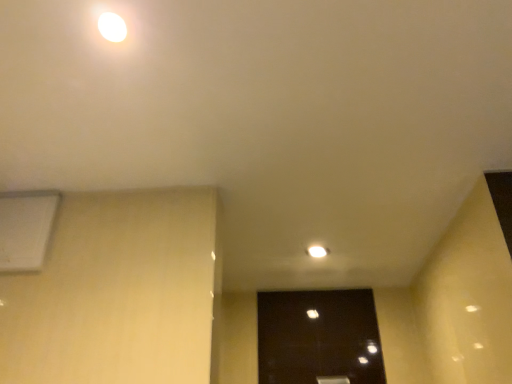
Question: Would you say white matte air conditioning at upper left is a long distance from white glossy light at upper center?

Choices:
 (A) no
 (B) yes

Answer: (A)

Question: From the image's perspective, is white matte air conditioning at upper left on white glossy light at upper center?

Choices:
 (A) yes
 (B) no

Answer: (B)

Question: Does white matte air conditioning at upper left have a greater height compared to white glossy light at upper center?

Choices:
 (A) yes
 (B) no

Answer: (A)

Question: Is white matte air conditioning at upper left next to white glossy light at upper center and touching it?

Choices:
 (A) yes
 (B) no

Answer: (B)

Question: From a real-world perspective, is white matte air conditioning at upper left located beneath white glossy light at upper center?

Choices:
 (A) yes
 (B) no

Answer: (A)

Question: From a real-world perspective, is white matte air conditioning at upper left physically above white glossy light at upper center?

Choices:
 (A) yes
 (B) no

Answer: (B)

Question: Is white glossy light at upper center taller than white matte air conditioning at upper left?

Choices:
 (A) no
 (B) yes

Answer: (A)

Question: Considering the relative sizes of white glossy light at upper center and white matte air conditioning at upper left in the image provided, is white glossy light at upper center bigger than white matte air conditioning at upper left?

Choices:
 (A) no
 (B) yes

Answer: (A)

Question: From the image's perspective, is white glossy light at upper center below white matte air conditioning at upper left?

Choices:
 (A) no
 (B) yes

Answer: (A)

Question: Is white glossy light at upper center touching white matte air conditioning at upper left?

Choices:
 (A) no
 (B) yes

Answer: (A)

Question: Is white glossy light at upper center thinner than white matte air conditioning at upper left?

Choices:
 (A) yes
 (B) no

Answer: (B)

Question: Does white glossy light at upper center have a smaller size compared to white matte air conditioning at upper left?

Choices:
 (A) no
 (B) yes

Answer: (B)

Question: Considering the relative positions of white matte air conditioning at upper left and white glossy light at upper center in the image provided, is white matte air conditioning at upper left to the left or to the right of white glossy light at upper center?

Choices:
 (A) left
 (B) right

Answer: (A)